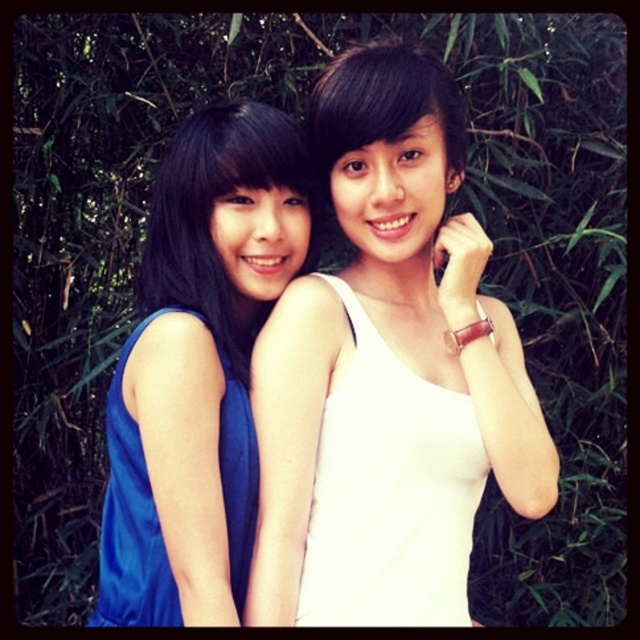
Is white matte tank top at center bigger than white satin dress at center?

Correct, white matte tank top at center is larger in size than white satin dress at center.

Can you confirm if white matte tank top at center is thinner than white satin dress at center?

No, white matte tank top at center is not thinner than white satin dress at center.

Who is more distant from viewer, (326, 524) or (384, 412)?

The point (326, 524) is behind.

Find the location of a particular element. The image size is (640, 640). white matte tank top at center is located at coordinates (388, 344).

Is point (416, 528) less distant than point (227, 372)?

Yes, it is in front of point (227, 372).

The width and height of the screenshot is (640, 640). Describe the element at coordinates (390, 493) in the screenshot. I see `white satin dress at center` at that location.

Identify the location of white satin dress at center. (390, 493).

Is white matte tank top at center thinner than matte blue dress at left?

No, white matte tank top at center is not thinner than matte blue dress at left.

Is point (365, 486) more distant than point (129, 509)?

No.

Which is behind, point (307, 438) or point (134, 625)?

Positioned behind is point (307, 438).

Identify the location of white matte tank top at center. (388, 344).